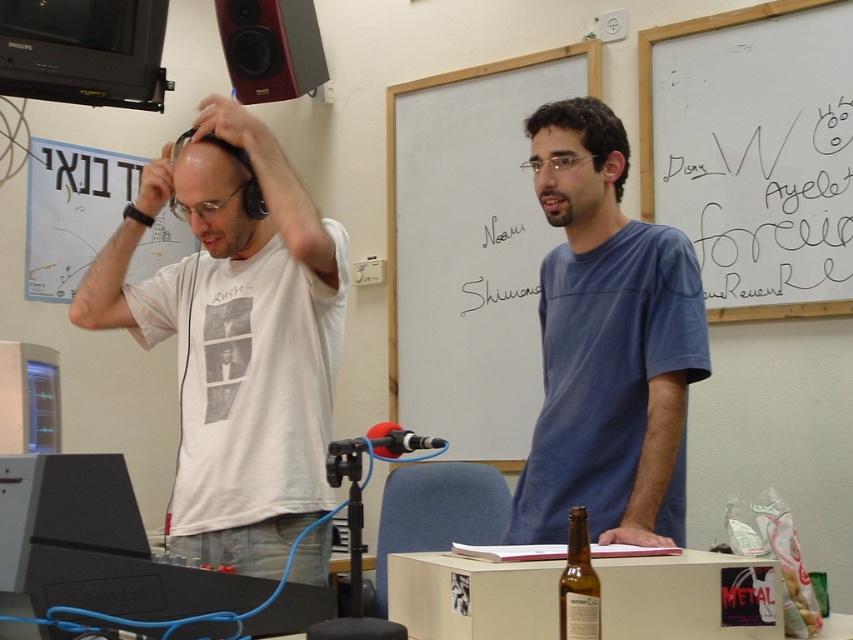
You are a photographer standing in the classroom and want to take a photo that includes both the blue cotton shirt at center and the white matte whiteboard at upper center. Considering their heights, which object will appear larger in the photo?

The blue cotton shirt at center is much taller than the white matte whiteboard at upper center, so it will appear larger in the photo.

You are a student sitting in the classroom and want to see both the blue cotton shirt at center and the white matte whiteboard at upper center. Which one can you see more clearly from your current position?

The blue cotton shirt at center is closer to the viewer than the white matte whiteboard at upper center, so you can see the blue cotton shirt at center more clearly.